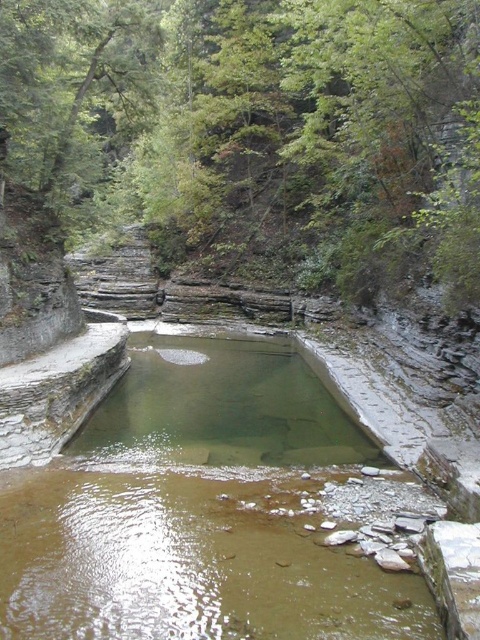
Question: Can you confirm if green leafy tree at upper center is smaller than clear stone pool at center?

Choices:
 (A) yes
 (B) no

Answer: (B)

Question: Can you confirm if green leafy tree at upper center is positioned below clear stone pool at center?

Choices:
 (A) yes
 (B) no

Answer: (B)

Question: Does green leafy tree at upper center appear over clear stone pool at center?

Choices:
 (A) no
 (B) yes

Answer: (B)

Question: Which point appears closest to the camera in this image?

Choices:
 (A) (163, 67)
 (B) (297, 579)

Answer: (B)